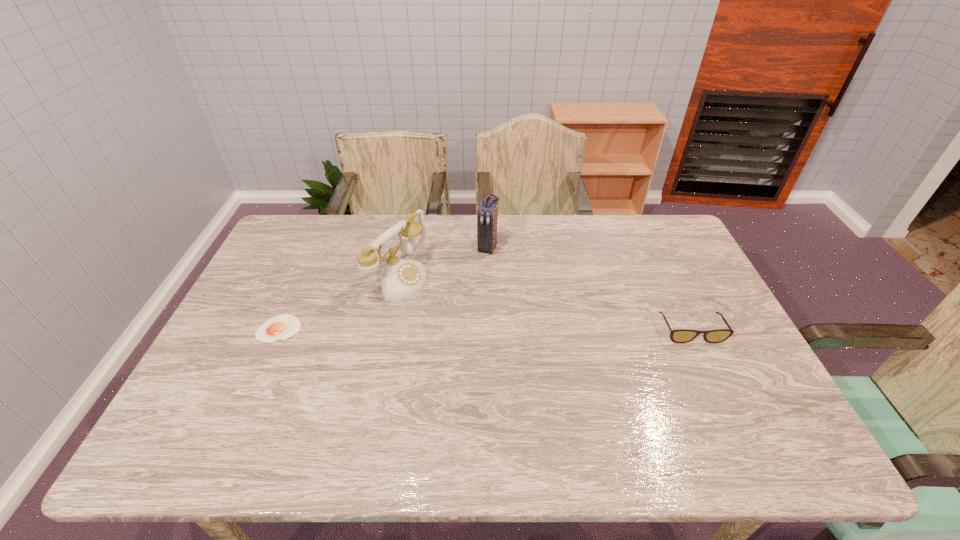
At what (x,y) coordinates should I click in order to perform the action: click on egg yolk. Please return your answer as a coordinate pair (x, y). This screenshot has width=960, height=540. Looking at the image, I should click on (281, 327).

The width and height of the screenshot is (960, 540). I want to click on the leftmost object, so click(281, 327).

At what (x,y) coordinates should I click in order to perform the action: click on the rightmost object. Please return your answer as a coordinate pair (x, y). Image resolution: width=960 pixels, height=540 pixels. Looking at the image, I should click on (678, 335).

The width and height of the screenshot is (960, 540). Find the location of `sunglasses`. sunglasses is located at coordinates (678, 335).

At what (x,y) coordinates should I click in order to perform the action: click on clutch bag. Please return your answer as a coordinate pair (x, y). The width and height of the screenshot is (960, 540). Looking at the image, I should click on (487, 213).

I want to click on telephone, so click(x=401, y=278).

In order to click on vacant space located 0.180m on the back of the leftmost object in this screenshot , I will do `click(304, 273)`.

You are a GUI agent. You are given a task and a screenshot of the screen. Output one action in this format:
    pyautogui.click(x=<x>, y=<y>)
    Task: Click on the free region located 0.050m on the front-facing side of the sunglasses
    
    Given the screenshot: What is the action you would take?
    pyautogui.click(x=704, y=359)

At what (x,y) coordinates should I click in order to perform the action: click on vacant space situated 0.310m with the zip open on the clutch bag. Please return your answer as a coordinate pair (x, y). The height and width of the screenshot is (540, 960). Looking at the image, I should click on (449, 324).

You are a GUI agent. You are given a task and a screenshot of the screen. Output one action in this format:
    pyautogui.click(x=<x>, y=<y>)
    Task: Click on the blank area located 0.150m with the zip open on the clutch bag
    The width and height of the screenshot is (960, 540).
    Given the screenshot: What is the action you would take?
    pyautogui.click(x=468, y=287)